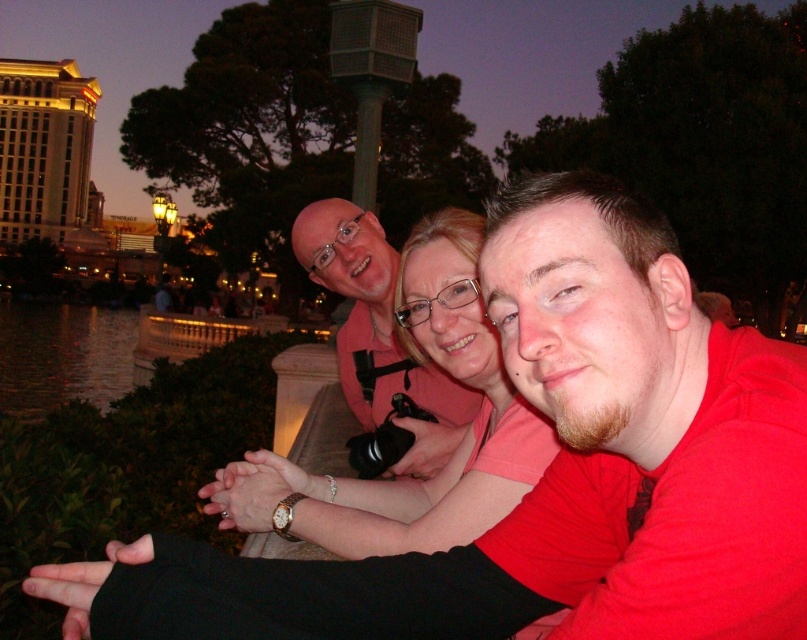
Question: Which object is farther from the camera taking this photo?

Choices:
 (A) pink fabric at center
 (B) dark reflective water at lower left
 (C) matte pink shirt at center

Answer: (B)

Question: Does matte pink shirt at center appear on the right side of dark reflective water at lower left?

Choices:
 (A) yes
 (B) no

Answer: (A)

Question: From the image, what is the correct spatial relationship of pink fabric at center in relation to dark reflective water at lower left?

Choices:
 (A) above
 (B) below

Answer: (B)

Question: Which object is positioned farthest from the pink fabric at center?

Choices:
 (A) dark reflective water at lower left
 (B) matte pink shirt at center

Answer: (A)

Question: Which point is closer to the camera?

Choices:
 (A) (471, 285)
 (B) (141, 369)
 (C) (312, 205)

Answer: (A)

Question: Can you confirm if matte pink shirt at center is smaller than dark reflective water at lower left?

Choices:
 (A) no
 (B) yes

Answer: (B)